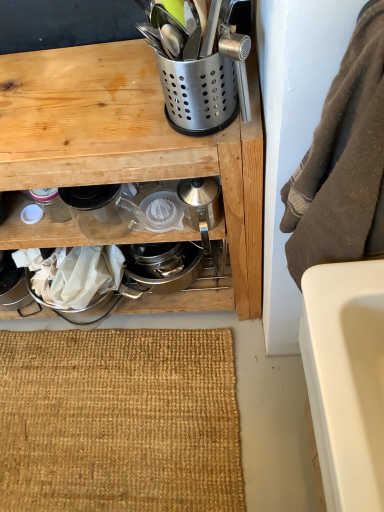
Question: Is satin silver utensil holder at upper center, which ranks as the 4th appliance in left-to-right order, further to camera compared to matte glass jar at lower left, acting as the fifth appliance starting from the right?

Choices:
 (A) no
 (B) yes

Answer: (A)

Question: Is satin silver utensil holder at upper center, marked as the 2th appliance in a right-to-left arrangement, in front of matte glass jar at lower left, acting as the fifth appliance starting from the right?

Choices:
 (A) no
 (B) yes

Answer: (B)

Question: Considering the relative sizes of satin silver utensil holder at upper center, marked as the 2th appliance in a right-to-left arrangement, and matte glass jar at lower left, acting as the fifth appliance starting from the right, in the image provided, is satin silver utensil holder at upper center, marked as the 2th appliance in a right-to-left arrangement, taller than matte glass jar at lower left, acting as the fifth appliance starting from the right,?

Choices:
 (A) yes
 (B) no

Answer: (A)

Question: Is satin silver utensil holder at upper center, marked as the 2th appliance in a right-to-left arrangement, to the left of matte glass jar at lower left, placed as the 1th appliance when sorted from left to right, from the viewer's perspective?

Choices:
 (A) no
 (B) yes

Answer: (A)

Question: Considering the relative sizes of satin silver utensil holder at upper center, which ranks as the 4th appliance in left-to-right order, and matte glass jar at lower left, acting as the fifth appliance starting from the right, in the image provided, is satin silver utensil holder at upper center, which ranks as the 4th appliance in left-to-right order, thinner than matte glass jar at lower left, acting as the fifth appliance starting from the right,?

Choices:
 (A) no
 (B) yes

Answer: (A)

Question: Is satin silver utensil holder at upper center, marked as the 2th appliance in a right-to-left arrangement, not inside matte glass jar at lower left, placed as the 1th appliance when sorted from left to right?

Choices:
 (A) no
 (B) yes

Answer: (B)

Question: Is matte glass jar at lower left, acting as the fifth appliance starting from the right, outside of clear glass pitcher at center, arranged as the 2th appliance when viewed from the left?

Choices:
 (A) no
 (B) yes

Answer: (B)

Question: Is matte glass jar at lower left, acting as the fifth appliance starting from the right, behind clear glass pitcher at center, arranged as the 2th appliance when viewed from the left?

Choices:
 (A) no
 (B) yes

Answer: (B)

Question: Is matte glass jar at lower left, placed as the 1th appliance when sorted from left to right, positioned far away from clear glass pitcher at center, the fourth appliance viewed from the right?

Choices:
 (A) no
 (B) yes

Answer: (A)

Question: From a real-world perspective, is matte glass jar at lower left, acting as the fifth appliance starting from the right, under clear glass pitcher at center, arranged as the 2th appliance when viewed from the left?

Choices:
 (A) yes
 (B) no

Answer: (A)

Question: Does matte glass jar at lower left, acting as the fifth appliance starting from the right, have a greater height compared to clear glass pitcher at center, the fourth appliance viewed from the right?

Choices:
 (A) no
 (B) yes

Answer: (A)

Question: Is matte glass jar at lower left, acting as the fifth appliance starting from the right, smaller than clear glass pitcher at center, arranged as the 2th appliance when viewed from the left?

Choices:
 (A) yes
 (B) no

Answer: (A)

Question: Considering the relative sizes of silver metallic kettle at center, marked as the fifth appliance in a left-to-right arrangement, and clear glass pitcher at center, the fourth appliance viewed from the right, in the image provided, is silver metallic kettle at center, marked as the fifth appliance in a left-to-right arrangement, shorter than clear glass pitcher at center, the fourth appliance viewed from the right,?

Choices:
 (A) yes
 (B) no

Answer: (B)